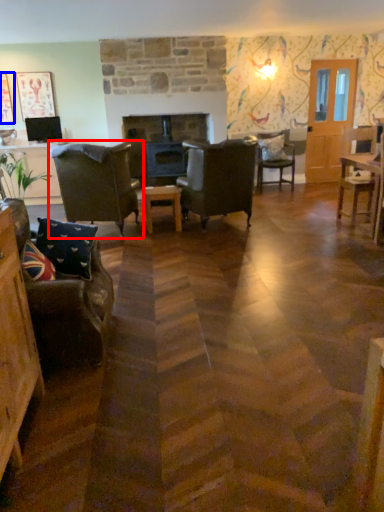
Question: Which point is further to the camera, chair (highlighted by a red box) or picture frame (highlighted by a blue box)?

Choices:
 (A) chair
 (B) picture frame

Answer: (B)